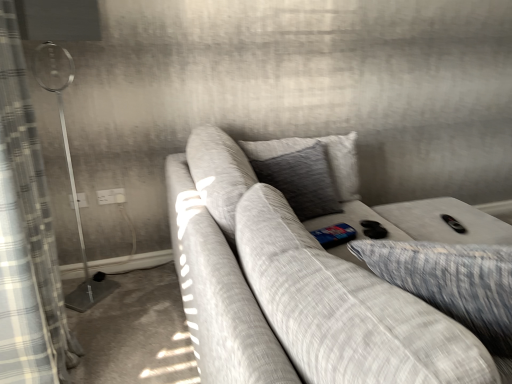
Question: From a real-world perspective, is white plastic electric outlet at upper left, marked as the 2th electric outlet in a left-to-right arrangement, below plaid fabric curtain at left?

Choices:
 (A) no
 (B) yes

Answer: (B)

Question: Could you tell me if white plastic electric outlet at upper left, placed as the 1th electric outlet when sorted from right to left, is turned towards plaid fabric curtain at left?

Choices:
 (A) no
 (B) yes

Answer: (B)

Question: From a real-world perspective, is white plastic electric outlet at upper left, placed as the 1th electric outlet when sorted from right to left, on top of plaid fabric curtain at left?

Choices:
 (A) yes
 (B) no

Answer: (B)

Question: Are white plastic electric outlet at upper left, placed as the 1th electric outlet when sorted from right to left, and plaid fabric curtain at left beside each other?

Choices:
 (A) yes
 (B) no

Answer: (B)

Question: Can you confirm if white plastic electric outlet at upper left, marked as the 2th electric outlet in a left-to-right arrangement, is wider than plaid fabric curtain at left?

Choices:
 (A) yes
 (B) no

Answer: (B)

Question: Can you confirm if white plastic electric outlet at upper left, marked as the 2th electric outlet in a left-to-right arrangement, is shorter than plaid fabric curtain at left?

Choices:
 (A) no
 (B) yes

Answer: (B)

Question: Can you confirm if textured gray pillow at right, arranged as the 1th pillow when viewed from the right, is wider than gray textured pillow at center, arranged as the 1th pillow when viewed from the left?

Choices:
 (A) no
 (B) yes

Answer: (B)

Question: Are textured gray pillow at right, the 2th pillow positioned from the left, and gray textured pillow at center, which is the second pillow in right-to-left order, beside each other?

Choices:
 (A) no
 (B) yes

Answer: (A)

Question: Is textured gray pillow at right, the 2th pillow positioned from the left, far away from gray textured pillow at center, arranged as the 1th pillow when viewed from the left?

Choices:
 (A) yes
 (B) no

Answer: (A)

Question: Can you confirm if textured gray pillow at right, the 2th pillow positioned from the left, is bigger than gray textured pillow at center, which is the second pillow in right-to-left order?

Choices:
 (A) no
 (B) yes

Answer: (B)

Question: From a real-world perspective, does textured gray pillow at right, arranged as the 1th pillow when viewed from the right, sit lower than gray textured pillow at center, arranged as the 1th pillow when viewed from the left?

Choices:
 (A) no
 (B) yes

Answer: (B)

Question: Would you say textured gray pillow at right, the 2th pillow positioned from the left, contains gray textured pillow at center, which is the second pillow in right-to-left order?

Choices:
 (A) no
 (B) yes

Answer: (A)

Question: Is gray textured pillow at center, which is the second pillow in right-to-left order, not inside plaid fabric curtain at left?

Choices:
 (A) no
 (B) yes

Answer: (B)